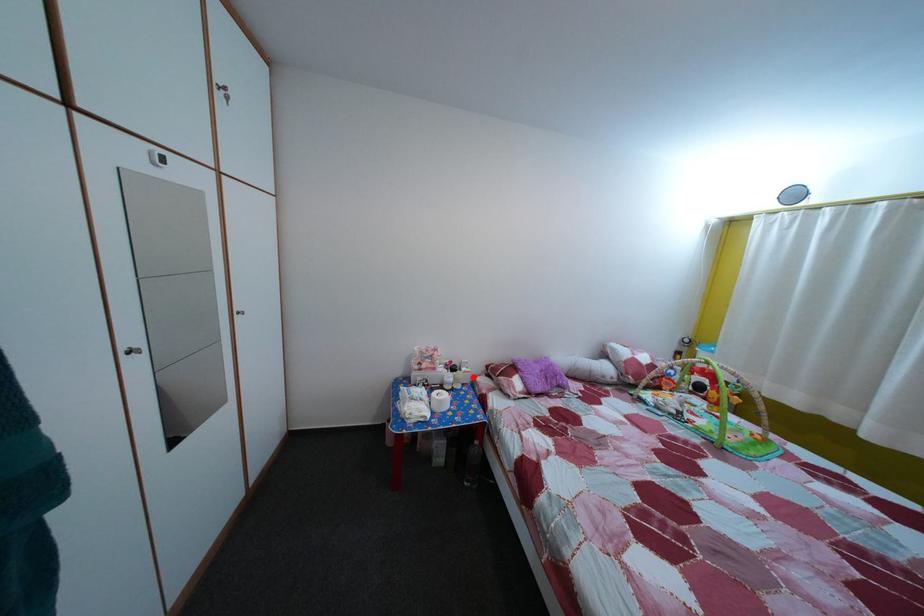
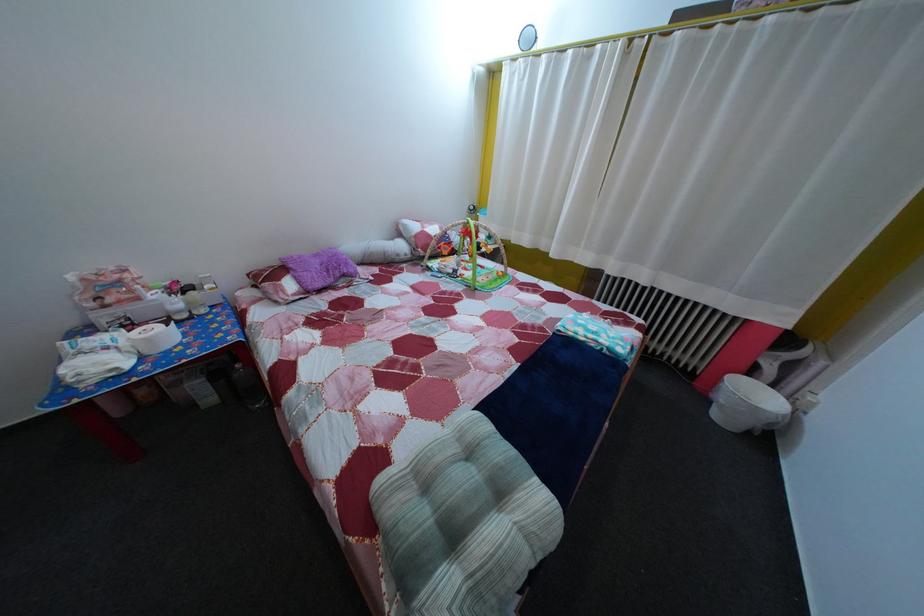
In the second image, find the point that corresponds to the highlighted location in the first image.

(216, 294)